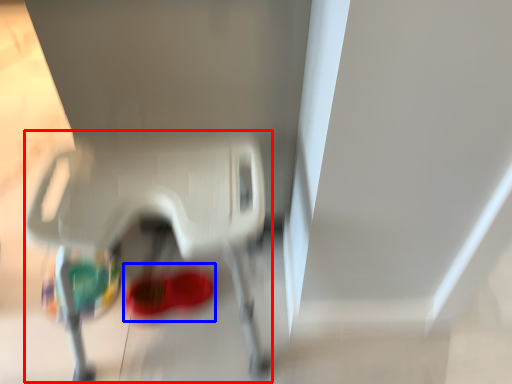
Question: Which of the following is the farthest to the observer, baby carriage (highlighted by a red box) or footwear (highlighted by a blue box)?

Choices:
 (A) baby carriage
 (B) footwear

Answer: (B)